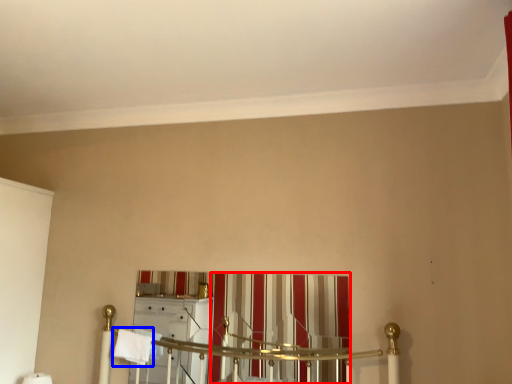
Question: Which point is further to the camera, curtain (highlighted by a red box) or bath towel (highlighted by a blue box)?

Choices:
 (A) curtain
 (B) bath towel

Answer: (B)